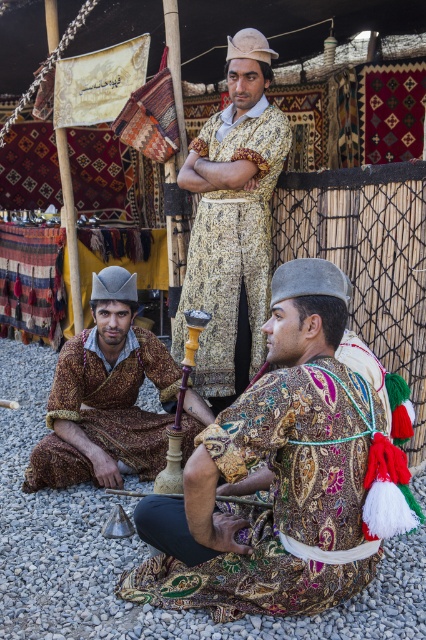
Question: Which point is closer to the camera?

Choices:
 (A) patterned fabric shisha at lower center
 (B) matte brown robe at lower left

Answer: (A)

Question: From the image, what is the correct spatial relationship of patterned fabric man at center in relation to matte brown robe at lower left?

Choices:
 (A) above
 (B) below

Answer: (A)

Question: Can you confirm if patterned fabric shisha at lower center is thinner than patterned fabric man at center?

Choices:
 (A) no
 (B) yes

Answer: (A)

Question: Is patterned fabric man at center smaller than matte brown robe at lower left?

Choices:
 (A) no
 (B) yes

Answer: (A)

Question: Among these objects, which one is nearest to the camera?

Choices:
 (A) patterned fabric shisha at lower center
 (B) patterned fabric man at center
 (C) matte brown robe at lower left

Answer: (A)

Question: Which point is farther to the camera?

Choices:
 (A) patterned fabric man at center
 (B) matte brown robe at lower left

Answer: (A)